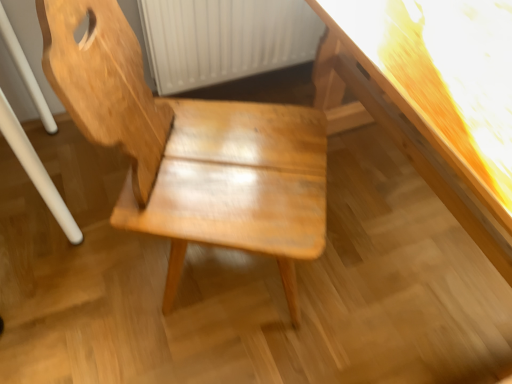
The height and width of the screenshot is (384, 512). Describe the element at coordinates (191, 150) in the screenshot. I see `wooden chair at center` at that location.

At what (x,y) coordinates should I click in order to perform the action: click on wooden chair at center. Please return your answer as a coordinate pair (x, y). Looking at the image, I should click on (191, 150).

This screenshot has width=512, height=384. In order to click on wooden chair at center in this screenshot , I will do `click(191, 150)`.